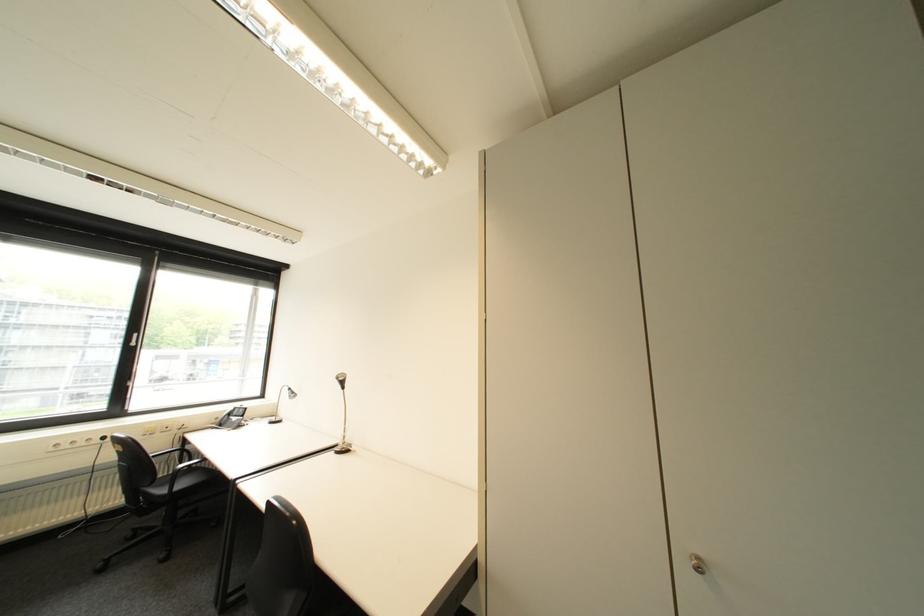
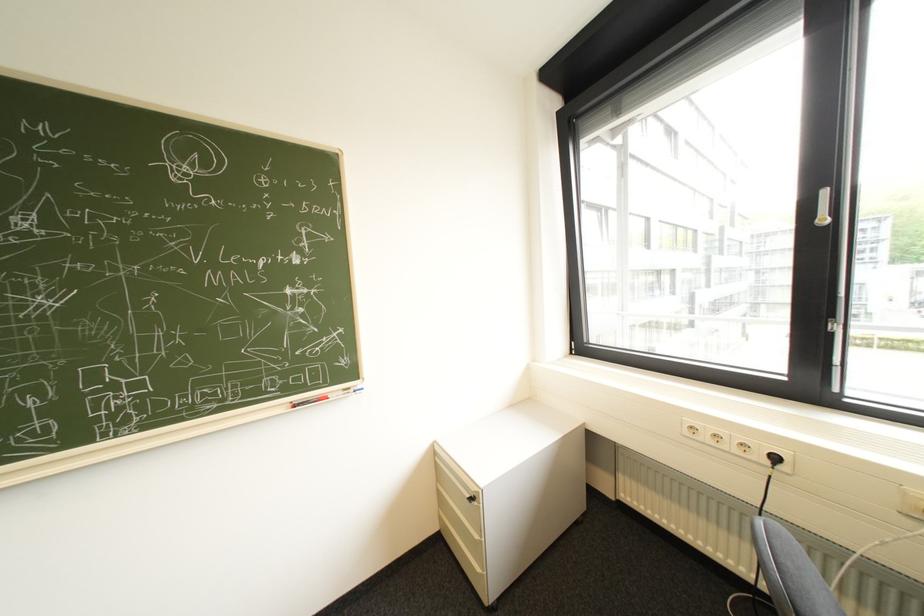
Where in the second image is the point corresponding to point 147,334 from the first image?

(834, 193)